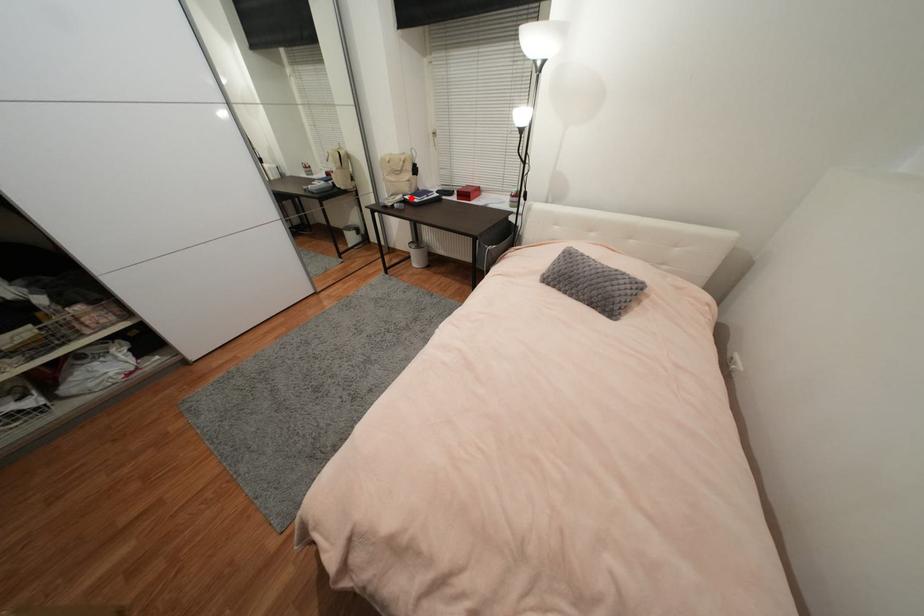
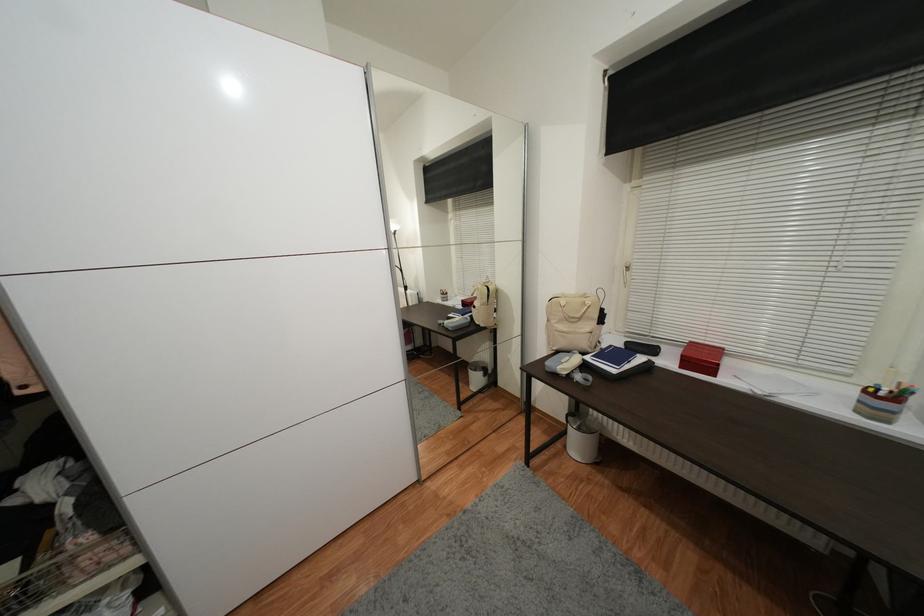
Question: I am providing you with two images of the same scene from different viewpoints. Given a red point in image1, look at the same physical point in image2. Is it:

Choices:
 (A) Closer to the viewpoint
 (B) Farther from the viewpoint

Answer: (B)